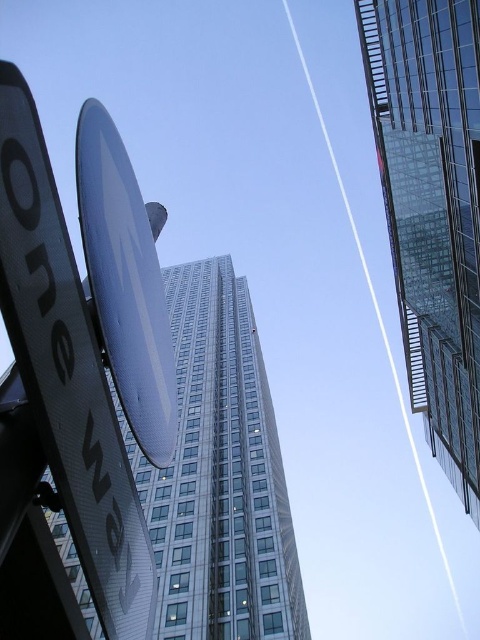
Question: Among these objects, which one is nearest to the camera?

Choices:
 (A) white glossy sign at upper left
 (B) metallic silver satellite dish at upper center
 (C) glassy reflective skyscraper at center
 (D) transparent glass skyscraper at upper right

Answer: (A)

Question: Estimate the real-world distances between objects in this image. Which object is farther from the white glossy sign at upper left?

Choices:
 (A) metallic silver satellite dish at upper center
 (B) glassy reflective skyscraper at center

Answer: (B)

Question: In this image, where is white glossy sign at upper left located relative to metallic silver satellite dish at upper center?

Choices:
 (A) below
 (B) above

Answer: (A)

Question: Does glassy reflective skyscraper at center have a smaller size compared to metallic silver satellite dish at upper center?

Choices:
 (A) no
 (B) yes

Answer: (A)

Question: Does glassy reflective skyscraper at center have a larger size compared to transparent glass skyscraper at upper right?

Choices:
 (A) no
 (B) yes

Answer: (B)

Question: Among these points, which one is farthest from the camera?

Choices:
 (A) (29, 164)
 (B) (254, 448)
 (C) (471, 349)

Answer: (B)